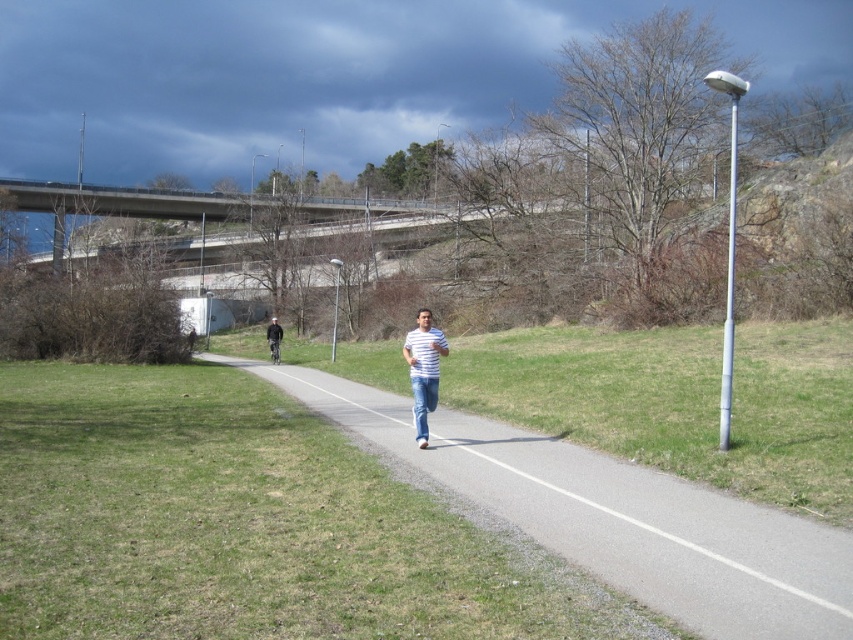
You are a delivery person with a 1.2 meter wide cart. You need to navigate through the gray asphalt path at center while avoiding the striped fabric shirt at center. Can your cart fit through the path without touching the shirt?

The gray asphalt path at center is wider than the striped fabric shirt at center. Since the path is wider than your 1.2 meter cart, you can navigate through it safely as long as you stay centered and avoid the shirt.

You are standing at the starting point of the path and want to reach the end of the path. Which point, point (671, 531) or point (416, 371), is closer to you as you begin your journey?

Point (671, 531) is closer to the viewer than point (416, 371), so you would reach point (671, 531) first as you start your journey.

You are standing on the paved path in the park and see the striped fabric shirt at center and the dark blue jeans at center. Which clothing item is positioned to the right of the other?

The striped fabric shirt at center is to the right of the dark blue jeans at center.